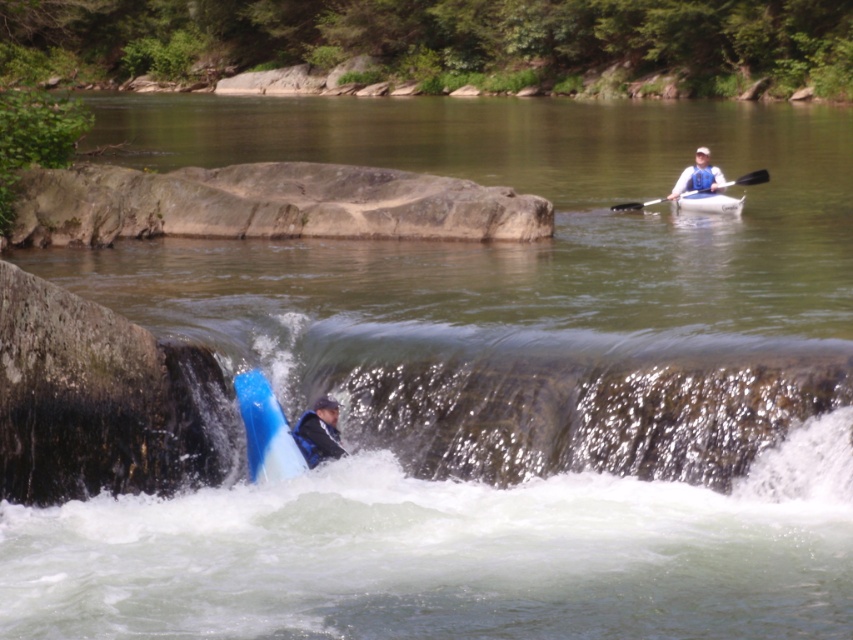
You are a river guide assessing safety conditions. You notice the blue glossy kayak at lower center and the black plastic paddle at upper right. Which object is narrower in width?

The blue glossy kayak at lower center is thinner than the black plastic paddle at upper right, so the kayak is narrower in width.

In the scene shown: You are planning to carry a long fishing rod in your boat. Based on the image, which boat between the blue glossy kayak at lower center and the white rubber canoe at upper center would allow you to store the rod more easily?

The white rubber canoe at upper center is wider than the blue glossy kayak at lower center, so the white rubber canoe at upper center would allow you to store the rod more easily.

You are a photographer trying to capture both the blue glossy kayak at lower center and the white rubber canoe at upper center in a single shot. Based on their positions, which one should you focus on first to ensure both are in frame?

The blue glossy kayak at lower center is in front of the white rubber canoe at upper center, so you should focus on the blue glossy kayak at lower center first to ensure both are in frame.